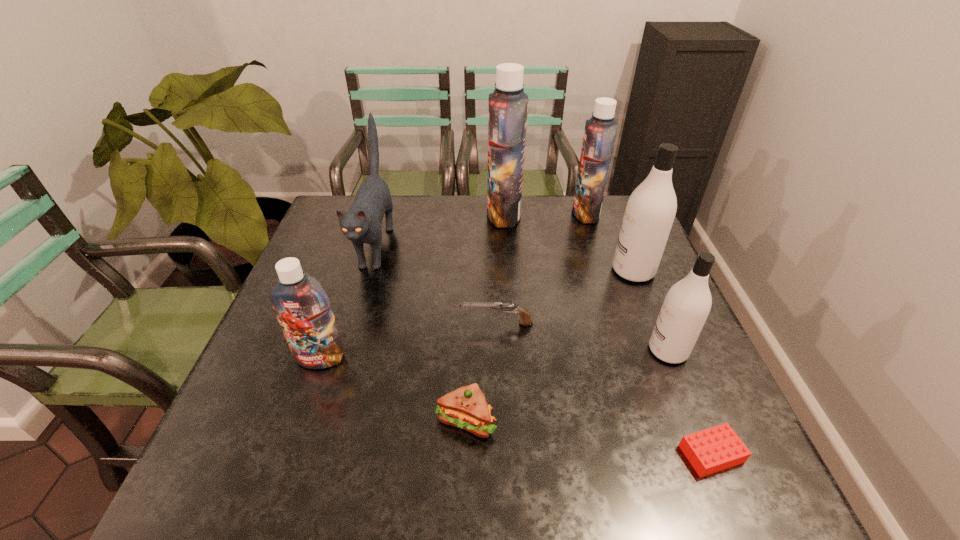
I want to click on free space between the leftmost blue shampoo and the gray cat, so click(x=348, y=302).

You are a GUI agent. You are given a task and a screenshot of the screen. Output one action in this format:
    pyautogui.click(x=<x>, y=<y>)
    Task: Click on the vacant area between the leftmost shampoo and the Lego
    The width and height of the screenshot is (960, 540).
    Given the screenshot: What is the action you would take?
    pyautogui.click(x=516, y=406)

The height and width of the screenshot is (540, 960). In order to click on vacant area that lies between the nearer white shampoo and the bigger white shampoo in this screenshot , I will do `click(651, 310)`.

The height and width of the screenshot is (540, 960). I want to click on object that is the seventh nearest to the smaller white shampoo, so click(x=361, y=224).

Select which object is the eighth closest to the gray cat. Please provide its 2D coordinates. Your answer should be formatted as a tuple, i.e. [(x, y)], where the tuple contains the x and y coordinates of a point satisfying the conditions above.

[(714, 449)]

Select which shampoo appears as the closest to the bigger white shampoo. Please provide its 2D coordinates. Your answer should be formatted as a tuple, i.e. [(x, y)], where the tuple contains the x and y coordinates of a point satisfying the conditions above.

[(600, 131)]

The height and width of the screenshot is (540, 960). What are the coordinates of `shampoo that is the second closest one to the farther white shampoo` in the screenshot? It's located at (687, 304).

The height and width of the screenshot is (540, 960). Identify the location of blue shampoo object that ranks as the closest to the shortest object. (302, 307).

Identify which blue shampoo is located as the second nearest to the third shortest object. Please provide its 2D coordinates. Your answer should be formatted as a tuple, i.e. [(x, y)], where the tuple contains the x and y coordinates of a point satisfying the conditions above.

[(508, 105)]

This screenshot has width=960, height=540. I want to click on vacant point that satisfies the following two spatial constraints: 1. on the front-facing side of the bigger white shampoo; 2. on the left side of the Lego, so click(x=708, y=454).